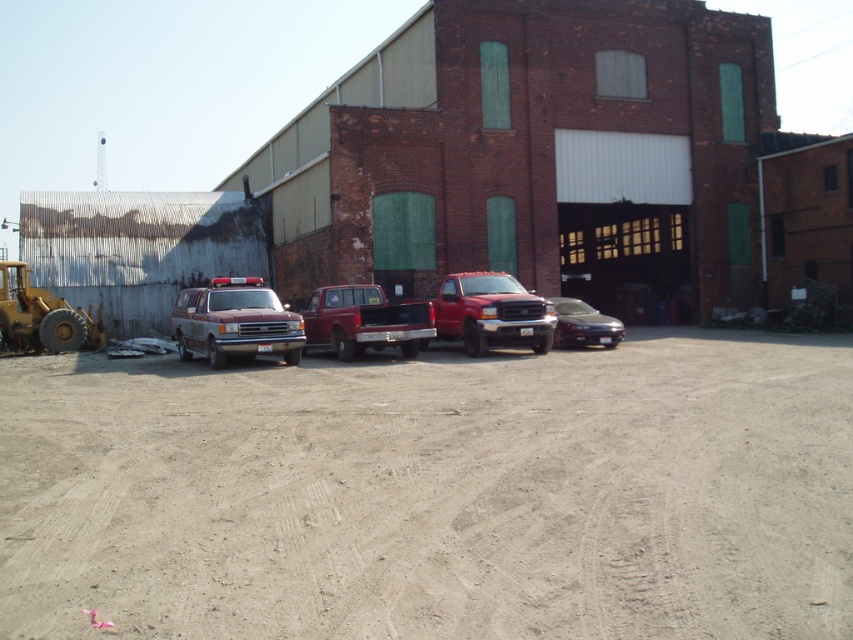
You are standing at the entrance of the industrial building and want to place a new equipment container at the dirt at center. According to the coordinates provided, where exactly should you place it?

The dirt at center should be placed at coordinates point (434,493).

You are a delivery driver who needs to park your vehicle between the maroon matte van at center and the yellow metallic bulldozer at left. Can you fit your 2.5 meter wide truck there?

The maroon matte van at center is to the right of the yellow metallic bulldozer at left, so there is space between them. Since your truck is 2.5 meters wide, you need to check the distance between them. However, the exact distance isn not provided in the description. Without knowing the actual space between the two vehicles, it is impossible to determine if your truck will fit.

You are a delivery driver who needs to park your 6.5 meter long truck between the maroon matte van at center and the yellow metallic bulldozer at left. Can you fit your truck in that space?

The maroon matte van at center is 7.33 meters away from the yellow metallic bulldozer at left. Since your truck is 6.5 meters long, it can fit in the space between them as the distance is greater than the truck length.